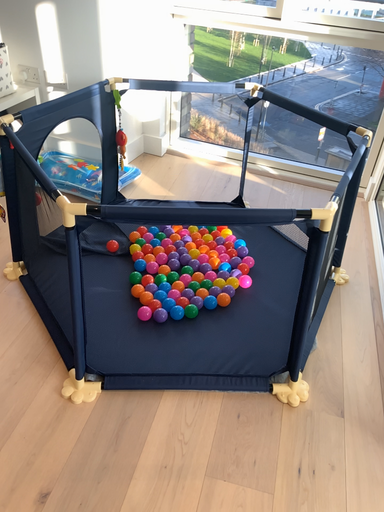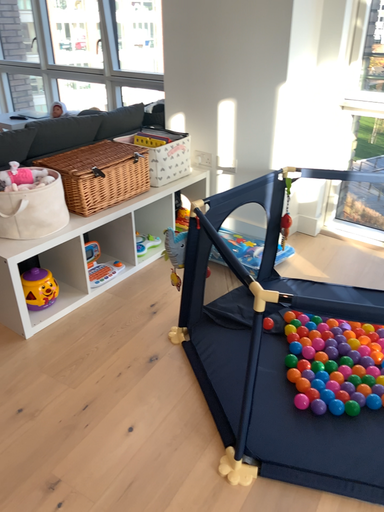
Question: How did the camera likely rotate when shooting the video?

Choices:
 (A) rotated right
 (B) rotated left

Answer: (B)